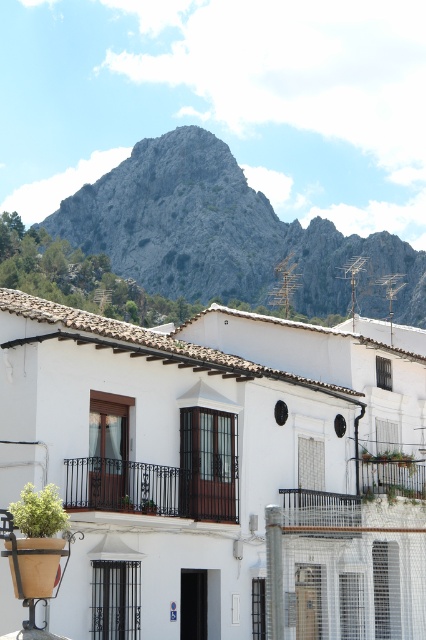
You are standing in front of the row of white buildings with terracotta roofs. You want to take a photo that includes both the rugged stone mountain at upper center and the black wrought iron balcony at center. Which object should be placed to the right side in your photo?

The rugged stone mountain at upper center should be placed to the right side of the black wrought iron balcony at center in your photo because the rugged stone mountain at upper center is positioned on the right side of black wrought iron balcony at center.

You are an architect designing a new building that needs to fit between the rugged stone mountain at upper center and the metallic black balcony at center. Which structure should you consider for the building placement to ensure it fits horizontally?

The rugged stone mountain at upper center is wider than the metallic black balcony at center, so the building should be placed closer to the metallic black balcony at center to ensure it fits horizontally.